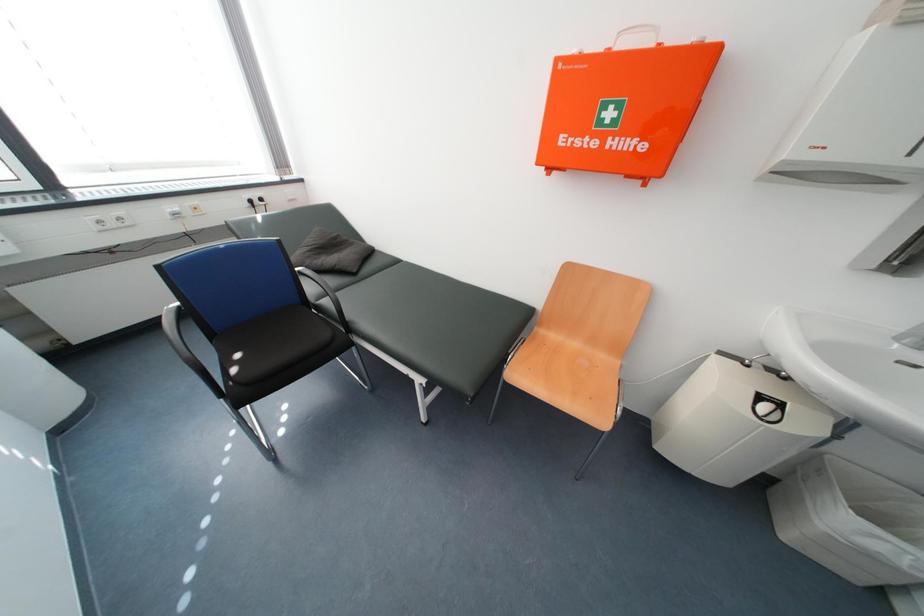
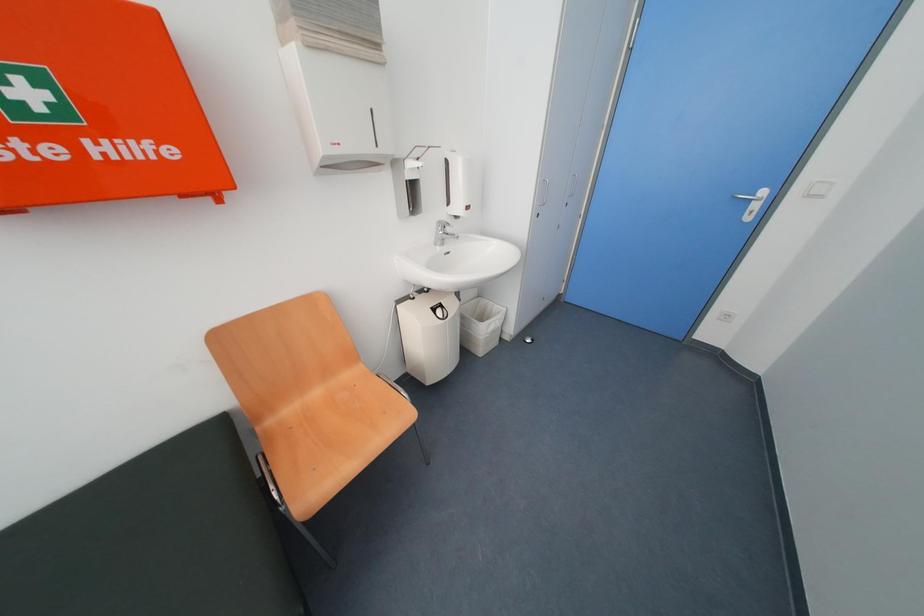
How did the camera likely rotate?

The camera's rotation is toward right-down.